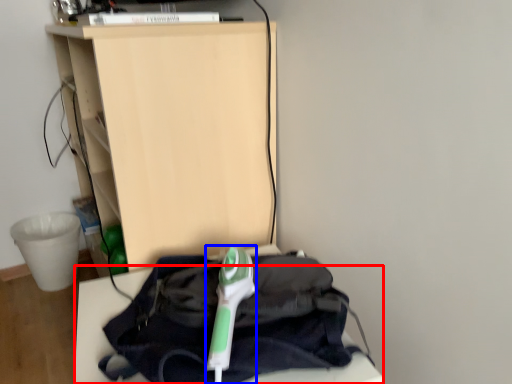
Question: Which object appears closest to the camera in this image, furniture (highlighted by a red box) or equipment (highlighted by a blue box)?

Choices:
 (A) furniture
 (B) equipment

Answer: (A)